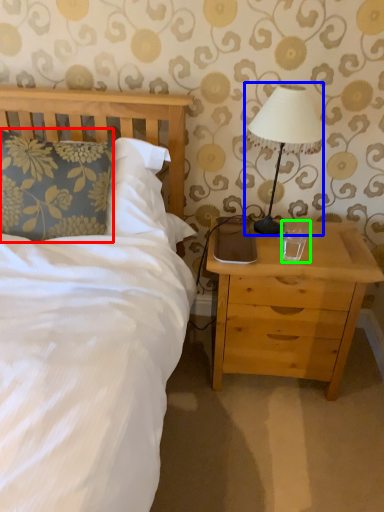
Question: Considering the real-world distances, which object is farthest from pillow (highlighted by a red box)? table lamp (highlighted by a blue box) or coffee cup (highlighted by a green box)?

Choices:
 (A) table lamp
 (B) coffee cup

Answer: (B)